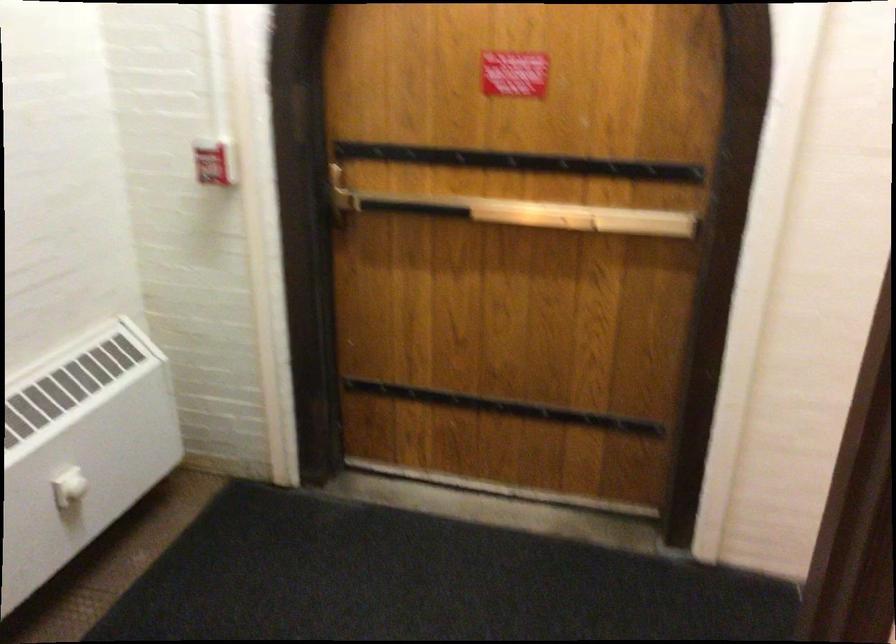
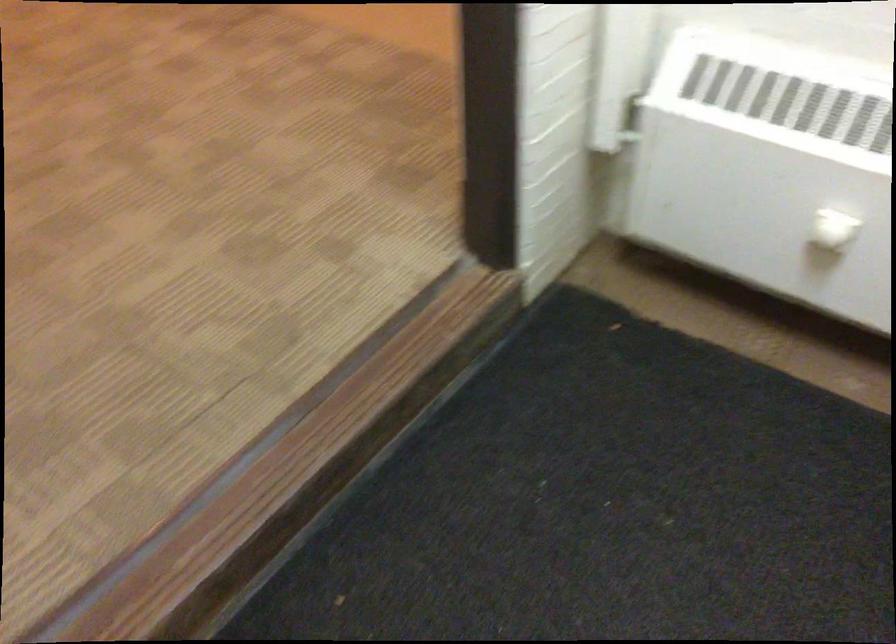
In the second image, find the point that corresponds to [92,474] in the first image.

(831, 236)